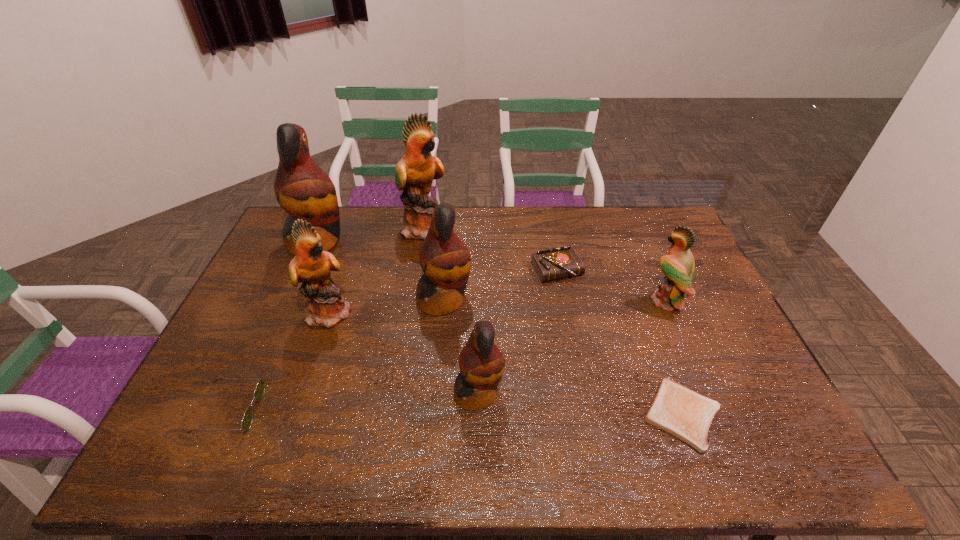
The height and width of the screenshot is (540, 960). What are the coordinates of `vacant space that is in between the smallest green parrot and the second biggest green parrot` in the screenshot? It's located at (498, 307).

This screenshot has width=960, height=540. Identify the location of free area in between the second nearest red parrot and the nearest parrot. (462, 347).

Identify the location of free point between the smallest green parrot and the leftmost green parrot. (498, 307).

I want to click on vacant point located between the rightmost parrot and the smallest red parrot, so click(572, 347).

Identify the location of free space between the smallest green parrot and the farthest red parrot. The image size is (960, 540). (492, 272).

Select which object is the third closest to the toast. Please provide its 2D coordinates. Your answer should be formatted as a tuple, i.e. [(x, y)], where the tuple contains the x and y coordinates of a point satisfying the conditions above.

[(561, 262)]

Locate an element on the screen. This screenshot has height=540, width=960. object that is the eighth closest one to the farthest red parrot is located at coordinates (678, 266).

The image size is (960, 540). I want to click on parrot that stands as the second closest to the smallest red parrot, so click(x=326, y=307).

Select which parrot is the second closest to the biggest green parrot. Please provide its 2D coordinates. Your answer should be formatted as a tuple, i.e. [(x, y)], where the tuple contains the x and y coordinates of a point satisfying the conditions above.

[(445, 260)]

The height and width of the screenshot is (540, 960). Find the location of `the third closest green parrot to the second biggest red parrot`. the third closest green parrot to the second biggest red parrot is located at coordinates (678, 266).